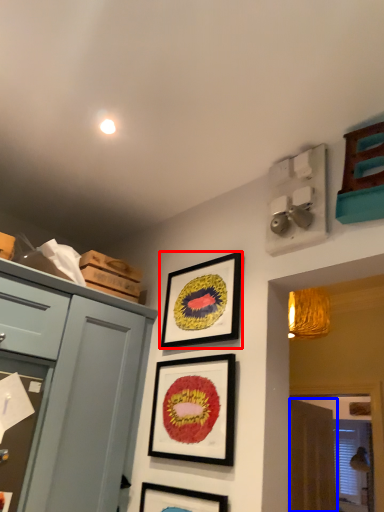
Question: Among these objects, which one is farthest to the camera, picture frame (highlighted by a red box) or curtain (highlighted by a blue box)?

Choices:
 (A) picture frame
 (B) curtain

Answer: (B)